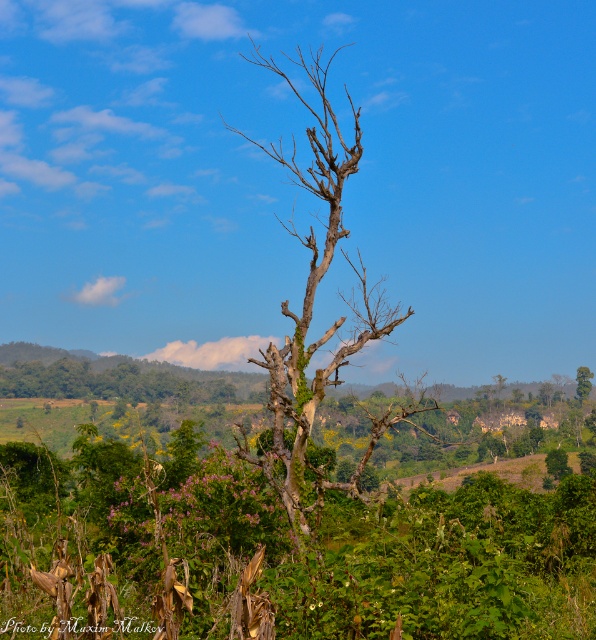
Question: Can you confirm if bare wood tree at center is smaller than green textured tree at center?

Choices:
 (A) yes
 (B) no

Answer: (B)

Question: Which point is farther to the camera?

Choices:
 (A) (588, 396)
 (B) (299, 372)

Answer: (A)

Question: Is bare wood tree at center to the left of green textured tree at center from the viewer's perspective?

Choices:
 (A) no
 (B) yes

Answer: (B)

Question: Which point appears closest to the camera in this image?

Choices:
 (A) [290, 472]
 (B) [588, 392]

Answer: (A)

Question: Is bare wood tree at center in front of green textured tree at center?

Choices:
 (A) yes
 (B) no

Answer: (A)